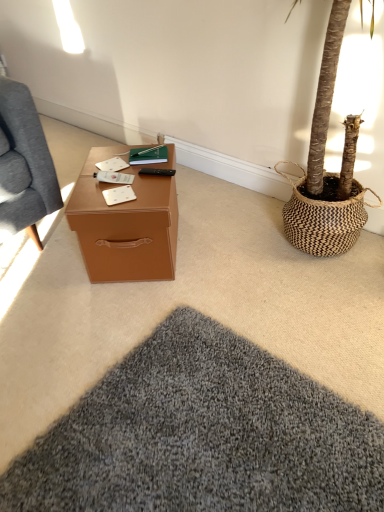
The image size is (384, 512). What are the coordinates of `vacant area that is in front of hardcover book at center` in the screenshot? It's located at (144, 182).